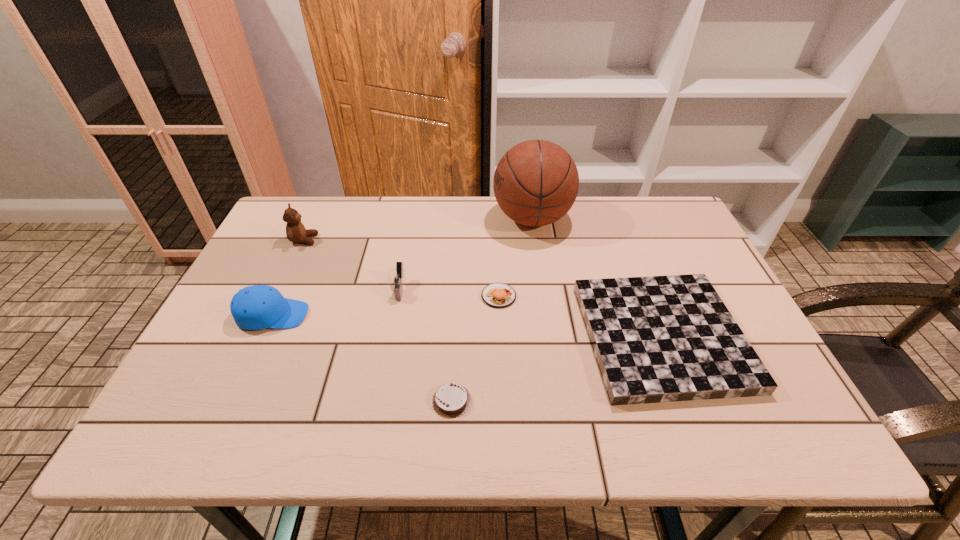
The height and width of the screenshot is (540, 960). Find the location of `free spot between the cap and the checkerboard`. free spot between the cap and the checkerboard is located at coordinates (467, 326).

You are a GUI agent. You are given a task and a screenshot of the screen. Output one action in this format:
    pyautogui.click(x=<x>, y=<y>)
    Task: Click on the vacant point located between the third object from left to right and the sixth shortest object
    
    Given the screenshot: What is the action you would take?
    pyautogui.click(x=352, y=265)

Identify the location of object that is the third nearest to the checkerboard. Image resolution: width=960 pixels, height=540 pixels. (451, 400).

This screenshot has height=540, width=960. I want to click on object that is the third closest to the cap, so click(451, 400).

This screenshot has height=540, width=960. I want to click on vacant region that satisfies the following two spatial constraints: 1. on the side with brand label of the tallest object; 2. on the left side of the second shortest object, so click(550, 336).

This screenshot has height=540, width=960. In order to click on blank space that satisfies the following two spatial constraints: 1. at the face of the second shortest object; 2. on the left side of the second tallest object in this screenshot , I will do `click(259, 336)`.

The height and width of the screenshot is (540, 960). Find the location of `free point that satisfies the following two spatial constraints: 1. on the back side of the sixth tallest object; 2. at the face of the sixth shortest object`. free point that satisfies the following two spatial constraints: 1. on the back side of the sixth tallest object; 2. at the face of the sixth shortest object is located at coordinates (624, 240).

Identify the location of vacant position in the image that satisfies the following two spatial constraints: 1. on the back side of the igniter; 2. at the face of the teddy bear. The image size is (960, 540). (410, 240).

Locate an element on the screen. The width and height of the screenshot is (960, 540). blank space that satisfies the following two spatial constraints: 1. at the face of the sixth shortest object; 2. on the left side of the fourth object from right to left is located at coordinates (228, 401).

I want to click on vacant space that satisfies the following two spatial constraints: 1. at the face of the patty; 2. on the left side of the teddy bear, so click(x=277, y=296).